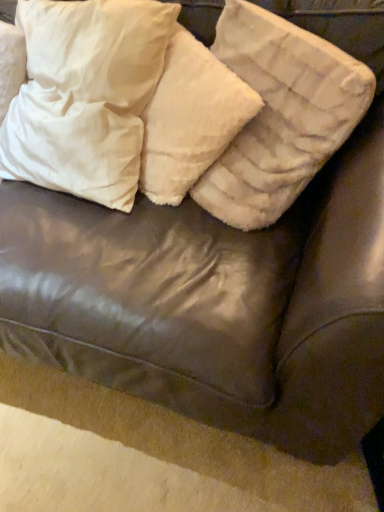
Question: Can you confirm if white fluffy pillow at upper center, marked as the 1th pillow in a right-to-left arrangement, is smaller than white soft pillow at upper left, positioned as the 1th pillow in left-to-right order?

Choices:
 (A) no
 (B) yes

Answer: (B)

Question: From the image's perspective, is white fluffy pillow at upper center, which is counted as the 3th pillow, starting from the left, above white soft pillow at upper left, which is the 3th pillow in right-to-left order?

Choices:
 (A) no
 (B) yes

Answer: (A)

Question: Is white fluffy pillow at upper center, marked as the 1th pillow in a right-to-left arrangement, to the left of white soft pillow at upper left, positioned as the 1th pillow in left-to-right order, from the viewer's perspective?

Choices:
 (A) no
 (B) yes

Answer: (A)

Question: Is white soft pillow at upper left, positioned as the 1th pillow in left-to-right order, at the back of white fluffy pillow at upper center, marked as the 1th pillow in a right-to-left arrangement?

Choices:
 (A) no
 (B) yes

Answer: (A)

Question: From their relative heights in the image, would you say white fluffy pillow at upper center, the 2th pillow positioned from the right, is taller or shorter than white soft pillow at upper left, positioned as the 1th pillow in left-to-right order?

Choices:
 (A) short
 (B) tall

Answer: (A)

Question: From a real-world perspective, is white fluffy pillow at upper center, arranged as the 2th pillow when viewed from the left, positioned above or below white soft pillow at upper left, positioned as the 1th pillow in left-to-right order?

Choices:
 (A) below
 (B) above

Answer: (A)

Question: Looking at the image, does white fluffy pillow at upper center, arranged as the 2th pillow when viewed from the left, seem bigger or smaller compared to white soft pillow at upper left, positioned as the 1th pillow in left-to-right order?

Choices:
 (A) small
 (B) big

Answer: (A)

Question: Which is correct: white fluffy pillow at upper center, arranged as the 2th pillow when viewed from the left, is inside white soft pillow at upper left, which is the 3th pillow in right-to-left order, or outside of it?

Choices:
 (A) outside
 (B) inside

Answer: (A)

Question: Relative to white fluffy pillow at upper center, marked as the 1th pillow in a right-to-left arrangement, is white fluffy pillow at upper center, arranged as the 2th pillow when viewed from the left, in front or behind?

Choices:
 (A) behind
 (B) front

Answer: (A)

Question: In terms of height, does white fluffy pillow at upper center, arranged as the 2th pillow when viewed from the left, look taller or shorter compared to white fluffy pillow at upper center, which is counted as the 3th pillow, starting from the left?

Choices:
 (A) tall
 (B) short

Answer: (B)

Question: Looking at their shapes, would you say white fluffy pillow at upper center, arranged as the 2th pillow when viewed from the left, is wider or thinner than white fluffy pillow at upper center, which is counted as the 3th pillow, starting from the left?

Choices:
 (A) wide
 (B) thin

Answer: (B)

Question: From a real-world perspective, is white fluffy pillow at upper center, arranged as the 2th pillow when viewed from the left, above or below white fluffy pillow at upper center, marked as the 1th pillow in a right-to-left arrangement?

Choices:
 (A) above
 (B) below

Answer: (B)

Question: Would you say white fluffy pillow at upper center, marked as the 1th pillow in a right-to-left arrangement, is inside or outside white fluffy pillow at upper center, arranged as the 2th pillow when viewed from the left?

Choices:
 (A) inside
 (B) outside

Answer: (B)

Question: Is white fluffy pillow at upper center, which is counted as the 3th pillow, starting from the left, taller or shorter than white fluffy pillow at upper center, arranged as the 2th pillow when viewed from the left?

Choices:
 (A) short
 (B) tall

Answer: (B)